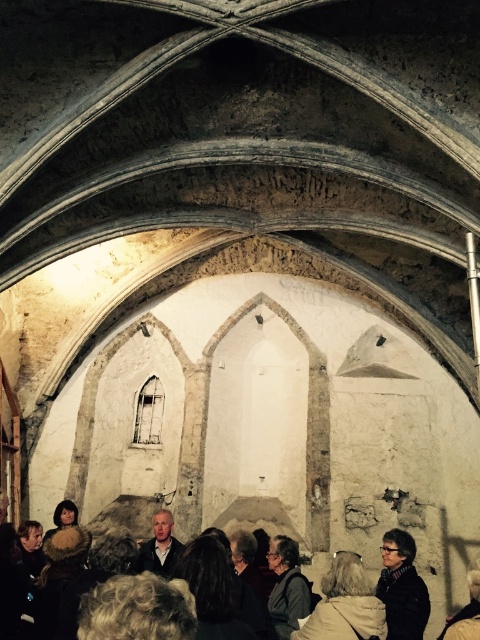
Question: Which object is the closest to the dark gray fabric jacket at center?

Choices:
 (A) matte black jacket at lower right
 (B) dark brown leather jacket at lower center

Answer: (B)

Question: Which of the following is the farthest from the observer?

Choices:
 (A) dark brown leather jacket at lower center
 (B) matte black jacket at lower right
 (C) dark gray fabric jacket at center

Answer: (C)

Question: Which object is closer to the camera taking this photo?

Choices:
 (A) matte black jacket at lower right
 (B) dark gray fabric jacket at center

Answer: (A)

Question: Is matte black jacket at lower right to the left of dark gray fabric jacket at center from the viewer's perspective?

Choices:
 (A) no
 (B) yes

Answer: (A)

Question: In this image, where is dark brown leather jacket at lower center located relative to dark gray fabric jacket at center?

Choices:
 (A) above
 (B) below

Answer: (A)

Question: Is dark brown leather jacket at lower center to the left of matte black jacket at lower right from the viewer's perspective?

Choices:
 (A) no
 (B) yes

Answer: (B)